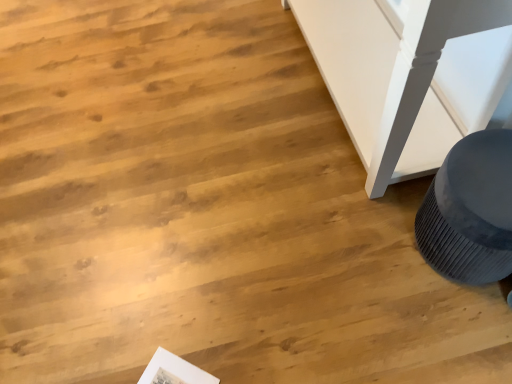
Question: Which is correct: matte gray speaker at lower right is inside white paper at lower left, or outside of it?

Choices:
 (A) inside
 (B) outside

Answer: (B)

Question: In terms of size, does matte gray speaker at lower right appear bigger or smaller than white paper at lower left?

Choices:
 (A) big
 (B) small

Answer: (A)

Question: From the image's perspective, relative to white paper at lower left, is matte gray speaker at lower right above or below?

Choices:
 (A) below
 (B) above

Answer: (B)

Question: From a real-world perspective, is white paper at lower left above or below matte gray speaker at lower right?

Choices:
 (A) below
 (B) above

Answer: (A)

Question: Would you say white paper at lower left is inside or outside matte gray speaker at lower right?

Choices:
 (A) outside
 (B) inside

Answer: (A)

Question: Considering their positions, is white paper at lower left located in front of or behind matte gray speaker at lower right?

Choices:
 (A) behind
 (B) front

Answer: (A)

Question: From the image's perspective, is white paper at lower left located above or below matte gray speaker at lower right?

Choices:
 (A) above
 (B) below

Answer: (B)